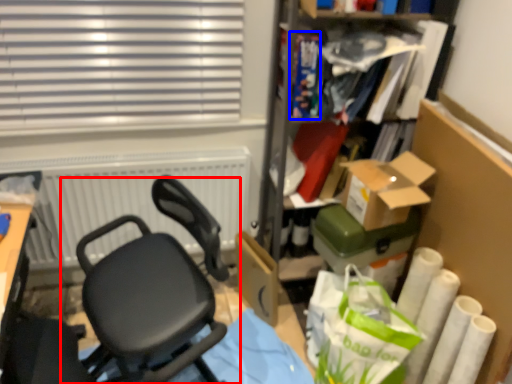
Question: Which point is closer to the camera, chair (highlighted by a red box) or book (highlighted by a blue box)?

Choices:
 (A) chair
 (B) book

Answer: (A)